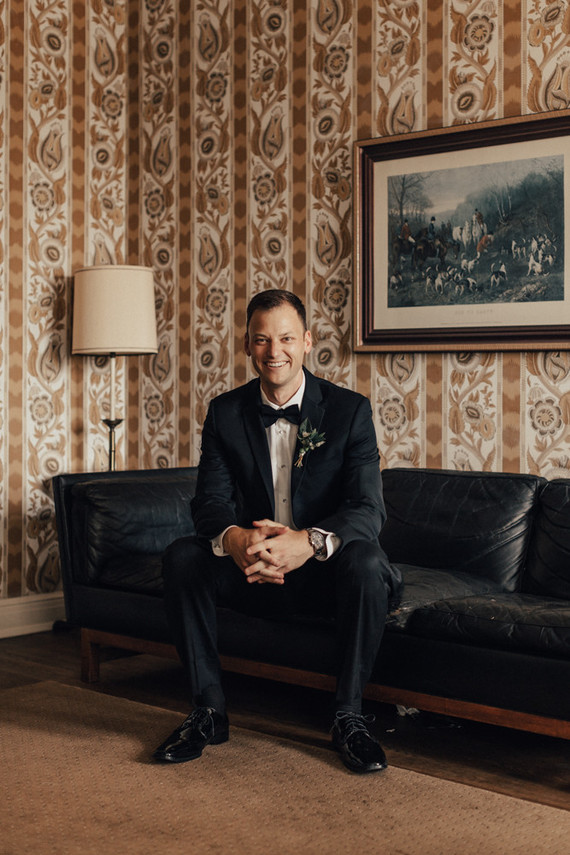
I want to click on rug, so click(183, 833).